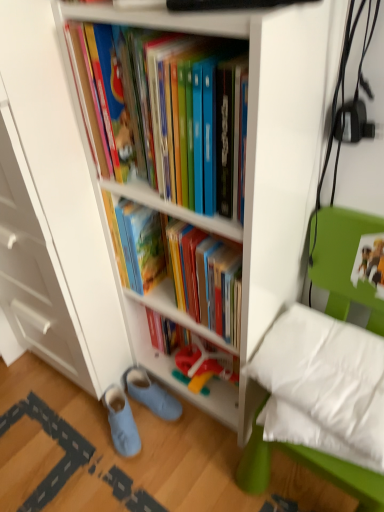
Where is `vacant area situated to the left side of light blue fabric slippers at lower left, placed as the 1th footwear when sorted from left to right`? vacant area situated to the left side of light blue fabric slippers at lower left, placed as the 1th footwear when sorted from left to right is located at coordinates (68, 436).